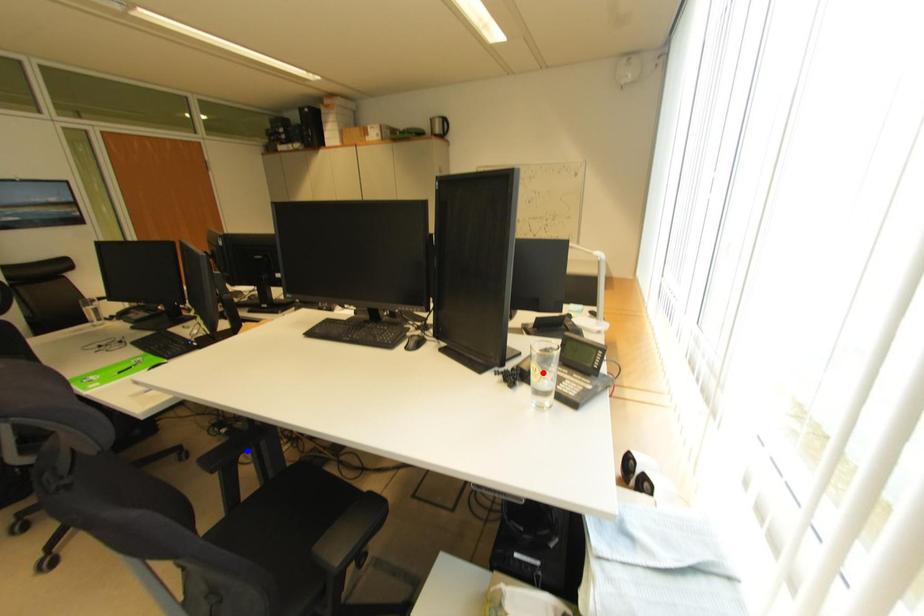
Question: Which of the two points in the image is closer to the camera?

Choices:
 (A) Blue point is closer.
 (B) Red point is closer.

Answer: (B)